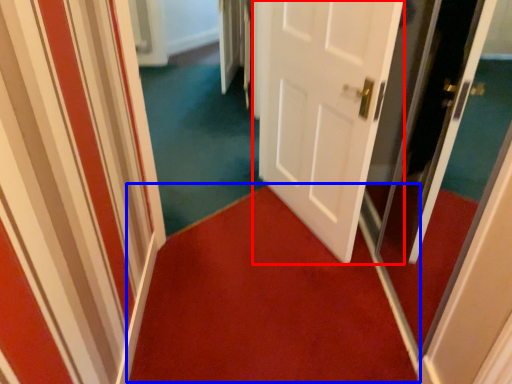
Question: Which point is further to the camera, door (highlighted by a red box) or doormat (highlighted by a blue box)?

Choices:
 (A) door
 (B) doormat

Answer: (B)